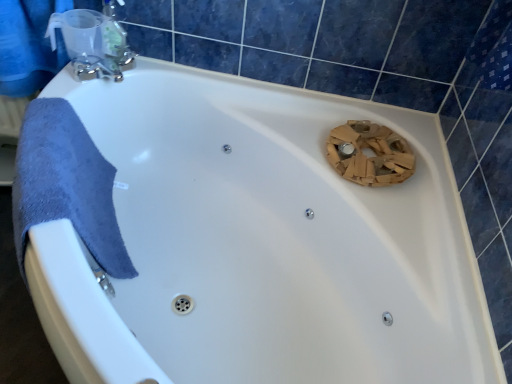
Locate an element on the screen. free space in front of satin nickel faucet at upper left is located at coordinates (85, 81).